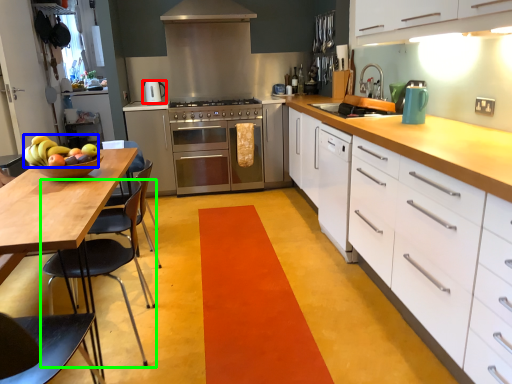
Question: Considering the real-world distances, which object is farthest from kitchen appliance (highlighted by a red box)? fruit (highlighted by a blue box) or chair (highlighted by a green box)?

Choices:
 (A) fruit
 (B) chair

Answer: (A)